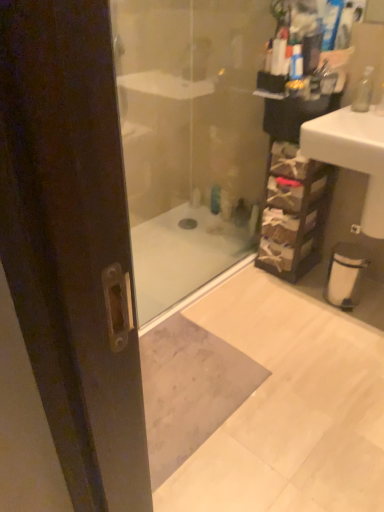
Question: From the image's perspective, relative to clear glass soap dispenser at upper right, is transparent glass shower door at center above or below?

Choices:
 (A) below
 (B) above

Answer: (A)

Question: Considering the positions of transparent glass shower door at center and clear glass soap dispenser at upper right in the image, is transparent glass shower door at center taller or shorter than clear glass soap dispenser at upper right?

Choices:
 (A) short
 (B) tall

Answer: (B)

Question: Estimate the real-world distances between objects in this image. Which object is closer to the brown woven basket at right?

Choices:
 (A) white glossy sink at right
 (B) translucent plastic bottle at center
 (C) clear glass soap dispenser at upper right
 (D) transparent glass shower door at center

Answer: (A)

Question: Which of these objects is positioned closest to the white glossy sink at right?

Choices:
 (A) brown woven basket at right
 (B) translucent plastic bottle at center
 (C) transparent glass shower door at center
 (D) clear glass soap dispenser at upper right

Answer: (D)